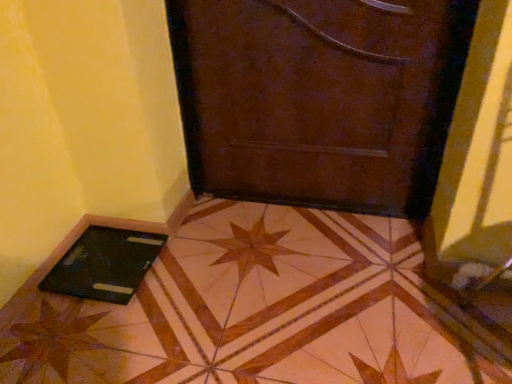
Question: Could you tell me if black glossy laptop at lower left is turned towards black matte tablet at lower left?

Choices:
 (A) no
 (B) yes

Answer: (A)

Question: Is black glossy laptop at lower left to the right of black matte tablet at lower left from the viewer's perspective?

Choices:
 (A) yes
 (B) no

Answer: (A)

Question: Can you confirm if black glossy laptop at lower left is wider than black matte tablet at lower left?

Choices:
 (A) no
 (B) yes

Answer: (B)

Question: Is black glossy laptop at lower left facing away from black matte tablet at lower left?

Choices:
 (A) no
 (B) yes

Answer: (A)

Question: Does black glossy laptop at lower left have a larger size compared to black matte tablet at lower left?

Choices:
 (A) no
 (B) yes

Answer: (B)

Question: From the image's perspective, is black glossy laptop at lower left located above or below black matte tablet at lower left?

Choices:
 (A) above
 (B) below

Answer: (B)

Question: Do you think black glossy laptop at lower left is within black matte tablet at lower left, or outside of it?

Choices:
 (A) outside
 (B) inside

Answer: (A)

Question: Is point (357, 251) positioned closer to the camera than point (81, 281)?

Choices:
 (A) closer
 (B) farther

Answer: (B)

Question: In terms of height, does black glossy laptop at lower left look taller or shorter compared to black matte tablet at lower left?

Choices:
 (A) tall
 (B) short

Answer: (A)

Question: In terms of width, does black matte tablet at lower left look wider or thinner when compared to black glossy laptop at lower left?

Choices:
 (A) thin
 (B) wide

Answer: (A)

Question: Visually, is black matte tablet at lower left positioned to the left or to the right of black glossy laptop at lower left?

Choices:
 (A) right
 (B) left

Answer: (B)

Question: Considering the positions of black matte tablet at lower left and black glossy laptop at lower left in the image, is black matte tablet at lower left taller or shorter than black glossy laptop at lower left?

Choices:
 (A) tall
 (B) short

Answer: (B)

Question: From the image's perspective, is black matte tablet at lower left located above or below black glossy laptop at lower left?

Choices:
 (A) below
 (B) above

Answer: (B)

Question: Is point (340, 109) closer or farther from the camera than point (398, 238)?

Choices:
 (A) closer
 (B) farther

Answer: (A)

Question: Looking at the image, does brown leather door at center seem bigger or smaller compared to black glossy laptop at lower left?

Choices:
 (A) big
 (B) small

Answer: (B)